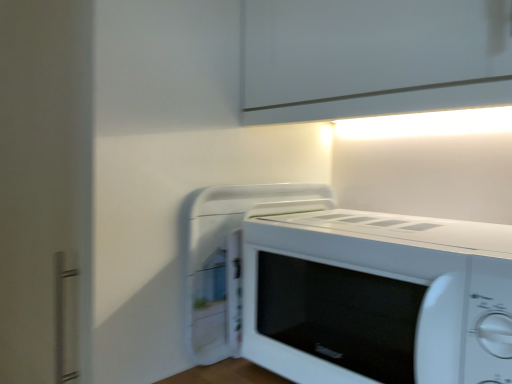
Question: Would you say white plastic microwave at center is part of white matte microwave at center's contents?

Choices:
 (A) no
 (B) yes

Answer: (A)

Question: Could you tell me if white matte microwave at center is facing white plastic microwave at center?

Choices:
 (A) yes
 (B) no

Answer: (B)

Question: From a real-world perspective, is white matte microwave at center located beneath white plastic microwave at center?

Choices:
 (A) no
 (B) yes

Answer: (B)

Question: Is white matte microwave at center behind white plastic microwave at center?

Choices:
 (A) yes
 (B) no

Answer: (B)

Question: Is white matte microwave at center positioned in front of white plastic microwave at center?

Choices:
 (A) yes
 (B) no

Answer: (A)

Question: Can you confirm if white matte microwave at center is bigger than white plastic microwave at center?

Choices:
 (A) yes
 (B) no

Answer: (A)

Question: Can you confirm if white plastic microwave at center is thinner than white matte microwave at center?

Choices:
 (A) no
 (B) yes

Answer: (A)

Question: Can we say white plastic microwave at center lies outside white matte microwave at center?

Choices:
 (A) no
 (B) yes

Answer: (B)

Question: From the image's perspective, is white plastic microwave at center over white matte microwave at center?

Choices:
 (A) yes
 (B) no

Answer: (A)

Question: Is white plastic microwave at center taller than white matte microwave at center?

Choices:
 (A) yes
 (B) no

Answer: (A)

Question: Is white plastic microwave at center closer to camera compared to white matte microwave at center?

Choices:
 (A) yes
 (B) no

Answer: (B)

Question: Can you confirm if white plastic microwave at center is positioned to the left of white matte microwave at center?

Choices:
 (A) yes
 (B) no

Answer: (A)

Question: Is white plastic microwave at center wider or thinner than white matte microwave at center?

Choices:
 (A) thin
 (B) wide

Answer: (B)